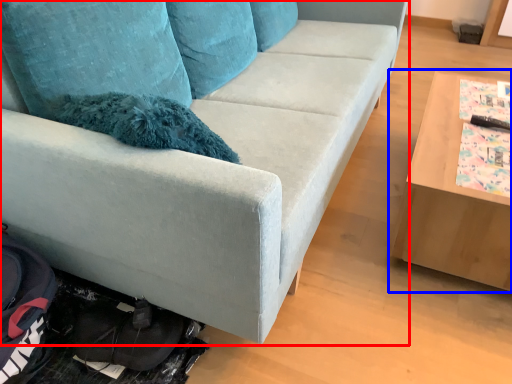
Question: Among these objects, which one is farthest to the camera, studio couch (highlighted by a red box) or table (highlighted by a blue box)?

Choices:
 (A) studio couch
 (B) table

Answer: (B)